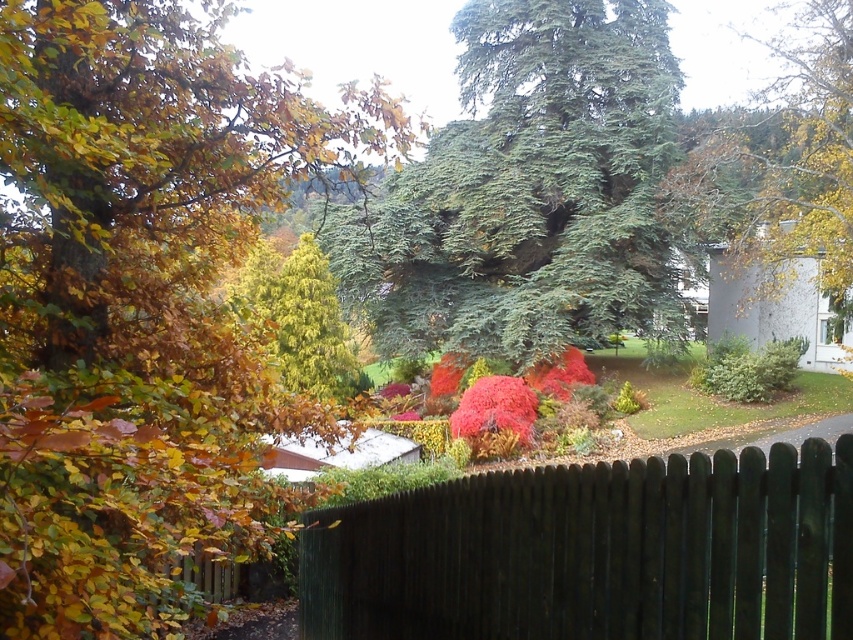
You are standing in the garden and see the point marked at coordinate (x=595, y=552). Based on the scene description, can you determine what object this point is located on?

The point is located on the dark brown wooden fence at lower center.